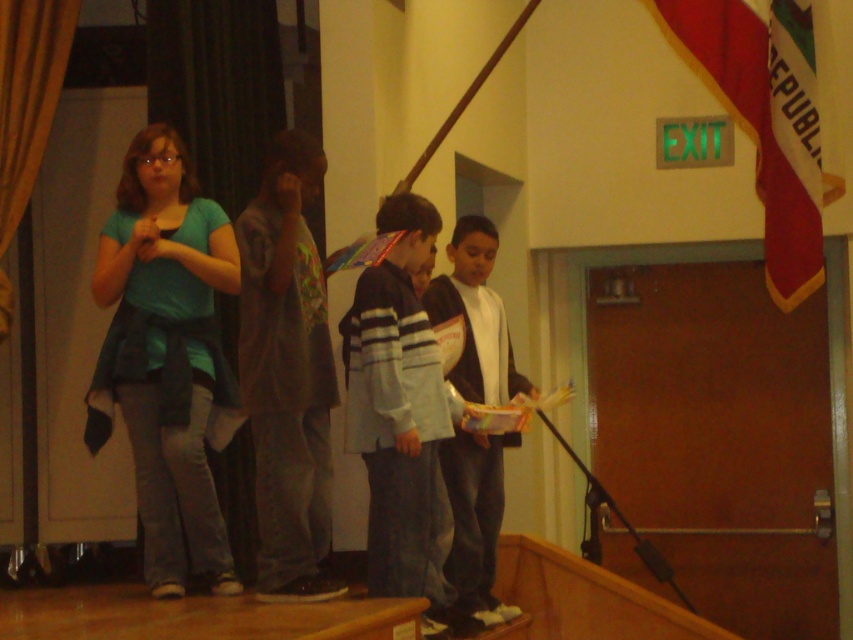
Question: Is striped sweater at center to the left of white matte jacket at center from the viewer's perspective?

Choices:
 (A) yes
 (B) no

Answer: (A)

Question: Is red fabric flag at upper right smaller than white matte jacket at center?

Choices:
 (A) no
 (B) yes

Answer: (A)

Question: Which of these objects is positioned farthest from the white matte jacket at center?

Choices:
 (A) striped sweater at center
 (B) teal fabric shirt at left

Answer: (B)

Question: Considering the real-world distances, which object is farthest from the teal fabric shirt at left?

Choices:
 (A) red fabric flag at upper right
 (B) striped sweater at center
 (C) white matte jacket at center

Answer: (A)

Question: Which object is the farthest from the white matte jacket at center?

Choices:
 (A) teal fabric shirt at left
 (B) red fabric flag at upper right

Answer: (B)

Question: Is red fabric flag at upper right wider than white matte jacket at center?

Choices:
 (A) no
 (B) yes

Answer: (B)